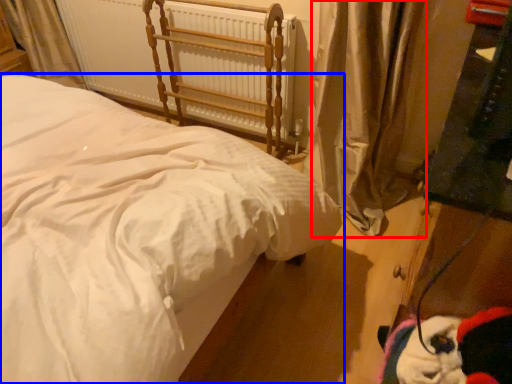
Question: Which of the following is the farthest to the observer, curtain (highlighted by a red box) or bed (highlighted by a blue box)?

Choices:
 (A) curtain
 (B) bed

Answer: (A)